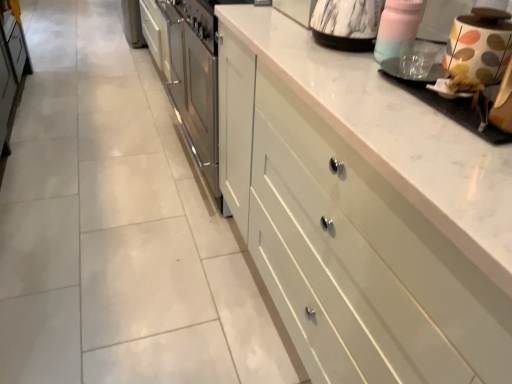
What do you see at coordinates (480, 44) in the screenshot? I see `polka dot ceramic jar at upper right, acting as the 3th appliance starting from the left` at bounding box center [480, 44].

Identify the location of marble-patterned kettle at upper right, the first appliance viewed from the left. click(346, 24).

Which object is thinner, polka dot ceramic jar at upper right, which is the 1th appliance from right to left, or white painted wood drawers at center?

polka dot ceramic jar at upper right, which is the 1th appliance from right to left.

Is white painted wood drawers at center at the back of polka dot ceramic jar at upper right, acting as the 3th appliance starting from the left?

polka dot ceramic jar at upper right, acting as the 3th appliance starting from the left, is not turned away from white painted wood drawers at center.

You are a GUI agent. You are given a task and a screenshot of the screen. Output one action in this format:
    pyautogui.click(x=<x>, y=<y>)
    Task: Click on the cabinetry below the polka dot ceramic jar at upper right, acting as the 3th appliance starting from the left (from a real-world perspective)
    This screenshot has width=512, height=384.
    Given the screenshot: What is the action you would take?
    pyautogui.click(x=373, y=218)

Considering the relative positions of polka dot ceramic jar at upper right, which is the 1th appliance from right to left, and white painted wood drawers at center in the image provided, is polka dot ceramic jar at upper right, which is the 1th appliance from right to left, to the left of white painted wood drawers at center from the viewer's perspective?

No.

Are white painted wood drawers at center and transparent plastic cup at upper right, which appears as the 2th appliance when viewed from the right, making contact?

No.

Locate an element on the screen. The image size is (512, 384). cabinetry that appears on the left of transparent plastic cup at upper right, which appears as the 2th appliance when viewed from the right is located at coordinates (373, 218).

Who is shorter, white painted wood drawers at center or transparent plastic cup at upper right, which appears as the 2th appliance when viewed from the right?

Standing shorter between the two is transparent plastic cup at upper right, which appears as the 2th appliance when viewed from the right.

From the picture: Choose the correct answer: Is white painted wood drawers at center inside transparent plastic cup at upper right, which appears as the 2th appliance when viewed from the right, or outside it?

white painted wood drawers at center is outside transparent plastic cup at upper right, which appears as the 2th appliance when viewed from the right.

Which object is thinner, white glossy coffee machine at upper right or polka dot ceramic jar at upper right, which is the 1th appliance from right to left?

polka dot ceramic jar at upper right, which is the 1th appliance from right to left, is thinner.

Is white glossy coffee machine at upper right next to polka dot ceramic jar at upper right, which is the 1th appliance from right to left, and touching it?

They are not placed beside each other.

Which object is closer to the camera, white glossy coffee machine at upper right or polka dot ceramic jar at upper right, acting as the 3th appliance starting from the left?

white glossy coffee machine at upper right is more forward.

Considering the relative sizes of white glossy coffee machine at upper right and transparent plastic cup at upper right, which appears as the 2th appliance when viewed from the right, in the image provided, is white glossy coffee machine at upper right shorter than transparent plastic cup at upper right, which appears as the 2th appliance when viewed from the right,?

Correct, white glossy coffee machine at upper right is not as tall as transparent plastic cup at upper right, which appears as the 2th appliance when viewed from the right.

Considering the relative sizes of white glossy coffee machine at upper right and transparent plastic cup at upper right, which appears as the 2th appliance when viewed from the right, in the image provided, is white glossy coffee machine at upper right bigger than transparent plastic cup at upper right, which appears as the 2th appliance when viewed from the right,?

Indeed, white glossy coffee machine at upper right has a larger size compared to transparent plastic cup at upper right, which appears as the 2th appliance when viewed from the right.

What's the angular difference between white glossy coffee machine at upper right and transparent plastic cup at upper right, which is counted as the second appliance, starting from the left,'s facing directions?

The angle between the facing direction of white glossy coffee machine at upper right and the facing direction of transparent plastic cup at upper right, which is counted as the second appliance, starting from the left, is 0.791 degrees.

Is white glossy coffee machine at upper right located outside transparent plastic cup at upper right, which is counted as the second appliance, starting from the left?

Absolutely, white glossy coffee machine at upper right is external to transparent plastic cup at upper right, which is counted as the second appliance, starting from the left.

Relative to white glossy coffee machine at upper right, is polka dot ceramic jar at upper right, acting as the 3th appliance starting from the left, in front or behind?

polka dot ceramic jar at upper right, acting as the 3th appliance starting from the left, is positioned farther from the viewer than white glossy coffee machine at upper right.

Could you tell me if polka dot ceramic jar at upper right, which is the 1th appliance from right to left, is turned towards white glossy coffee machine at upper right?

No, polka dot ceramic jar at upper right, which is the 1th appliance from right to left, does not turn towards white glossy coffee machine at upper right.

Looking at the image, does polka dot ceramic jar at upper right, acting as the 3th appliance starting from the left, seem bigger or smaller compared to white glossy coffee machine at upper right?

Clearly, polka dot ceramic jar at upper right, acting as the 3th appliance starting from the left, is smaller in size than white glossy coffee machine at upper right.

Is white painted wood drawers at center located outside polka dot ceramic jar at upper right, acting as the 3th appliance starting from the left?

Yes.

From a real-world perspective, does white painted wood drawers at center sit lower than polka dot ceramic jar at upper right, acting as the 3th appliance starting from the left?

Yes, from a real-world perspective, white painted wood drawers at center is below polka dot ceramic jar at upper right, acting as the 3th appliance starting from the left.

In the image, is white painted wood drawers at center positioned in front of or behind polka dot ceramic jar at upper right, which is the 1th appliance from right to left?

In the image, white painted wood drawers at center appears in front of polka dot ceramic jar at upper right, which is the 1th appliance from right to left.

Is transparent plastic cup at upper right, which is counted as the second appliance, starting from the left, beside white glossy coffee machine at upper right?

Absolutely, transparent plastic cup at upper right, which is counted as the second appliance, starting from the left, is next to and touching white glossy coffee machine at upper right.

Would you say transparent plastic cup at upper right, which is counted as the second appliance, starting from the left, contains white glossy coffee machine at upper right?

No.

Is transparent plastic cup at upper right, which is counted as the second appliance, starting from the left, oriented away from white glossy coffee machine at upper right?

Yes, transparent plastic cup at upper right, which is counted as the second appliance, starting from the left,'s orientation is away from white glossy coffee machine at upper right.

You are a GUI agent. You are given a task and a screenshot of the screen. Output one action in this format:
    pyautogui.click(x=<x>, y=<y>)
    Task: Click on the 1st appliance behind the white painted wood drawers at center
    This screenshot has height=384, width=512.
    Given the screenshot: What is the action you would take?
    pyautogui.click(x=480, y=44)

Find the location of a particular element. Image resolution: width=512 pixels, height=384 pixels. cabinetry that appears in front of the transparent plastic cup at upper right, which is counted as the second appliance, starting from the left is located at coordinates (373, 218).

Which object lies further to the anchor point transparent plastic cup at upper right, which is counted as the second appliance, starting from the left, polka dot ceramic jar at upper right, acting as the 3th appliance starting from the left, or white glossy coffee machine at upper right?

Among the two, polka dot ceramic jar at upper right, acting as the 3th appliance starting from the left, is located further to transparent plastic cup at upper right, which is counted as the second appliance, starting from the left.

Estimate the real-world distances between objects in this image. Which object is further from white painted wood drawers at center, transparent plastic cup at upper right, which is counted as the second appliance, starting from the left, or marble-patterned kettle at upper right, the first appliance viewed from the left?

The object further to white painted wood drawers at center is marble-patterned kettle at upper right, the first appliance viewed from the left.

Estimate the real-world distances between objects in this image. Which object is closer to white glossy coffee machine at upper right, transparent plastic cup at upper right, which is counted as the second appliance, starting from the left, or white painted wood drawers at center?

transparent plastic cup at upper right, which is counted as the second appliance, starting from the left, is closer to white glossy coffee machine at upper right.

Considering their positions, is white painted wood drawers at center positioned further to transparent plastic cup at upper right, which appears as the 2th appliance when viewed from the right, than white glossy coffee machine at upper right?

The object further to transparent plastic cup at upper right, which appears as the 2th appliance when viewed from the right, is white painted wood drawers at center.

Estimate the real-world distances between objects in this image. Which object is closer to white painted wood drawers at center, marble-patterned kettle at upper right, acting as the 3th appliance starting from the right, or polka dot ceramic jar at upper right, acting as the 3th appliance starting from the left?

polka dot ceramic jar at upper right, acting as the 3th appliance starting from the left, is positioned closer to the anchor white painted wood drawers at center.

Estimate the real-world distances between objects in this image. Which object is closer to white glossy coffee machine at upper right, polka dot ceramic jar at upper right, which is the 1th appliance from right to left, or marble-patterned kettle at upper right, the first appliance viewed from the left?

The object closer to white glossy coffee machine at upper right is polka dot ceramic jar at upper right, which is the 1th appliance from right to left.

Which object lies further to the anchor point marble-patterned kettle at upper right, the first appliance viewed from the left, polka dot ceramic jar at upper right, which is the 1th appliance from right to left, or white painted wood drawers at center?

white painted wood drawers at center lies further to marble-patterned kettle at upper right, the first appliance viewed from the left, than the other object.

Based on their spatial positions, is polka dot ceramic jar at upper right, which is the 1th appliance from right to left, or marble-patterned kettle at upper right, the first appliance viewed from the left, closer to white painted wood drawers at center?

Among the two, polka dot ceramic jar at upper right, which is the 1th appliance from right to left, is located nearer to white painted wood drawers at center.

At what (x,y) coordinates should I click in order to perform the action: click on appliance between transparent plastic cup at upper right, which appears as the 2th appliance when viewed from the right, and white glossy coffee machine at upper right. Please return your answer as a coordinate pair (x, y). Looking at the image, I should click on (480, 44).

What are the coordinates of `appliance between white painted wood drawers at center and transparent plastic cup at upper right, which is counted as the second appliance, starting from the left, from front to back` in the screenshot? It's located at (x=480, y=44).

The height and width of the screenshot is (384, 512). Identify the location of coffee machine between white painted wood drawers at center and marble-patterned kettle at upper right, the first appliance viewed from the left, from front to back. (459, 114).

What are the coordinates of `coffee machine located between white painted wood drawers at center and polka dot ceramic jar at upper right, acting as the 3th appliance starting from the left, in the depth direction` in the screenshot? It's located at (459, 114).